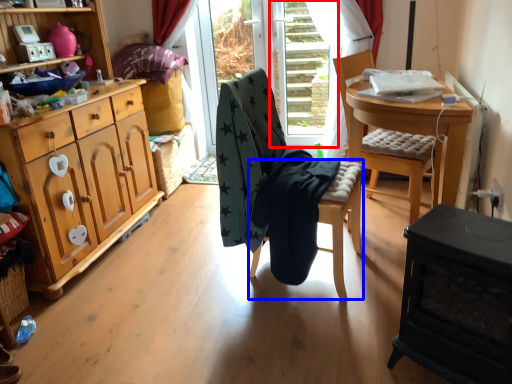
Question: Which of the following is the farthest to the observer, screen door (highlighted by a red box) or stool (highlighted by a blue box)?

Choices:
 (A) screen door
 (B) stool

Answer: (A)